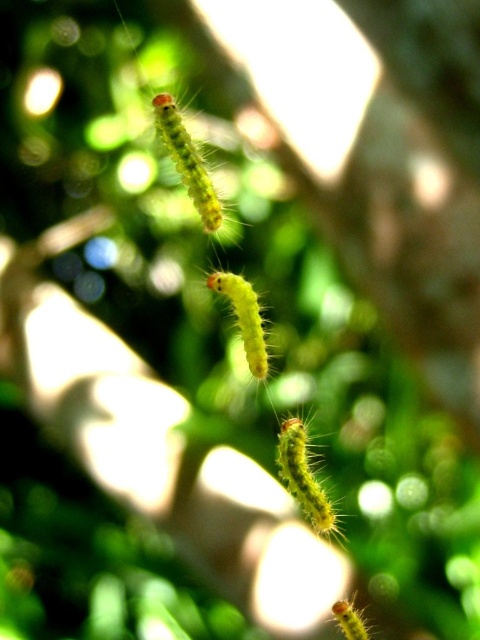
Question: Which point is farther to the camera?

Choices:
 (A) (233, 296)
 (B) (338, 600)
 (C) (312, 504)

Answer: (A)

Question: Considering the relative positions of fuzzy yellow caterpillar at center and yellow fuzzy caterpillar at center in the image provided, where is fuzzy yellow caterpillar at center located with respect to yellow fuzzy caterpillar at center?

Choices:
 (A) right
 (B) left

Answer: (A)

Question: Among these objects, which one is farthest from the camera?

Choices:
 (A) fuzzy yellow caterpillar at upper center
 (B) fuzzy yellow caterpillar at lower right

Answer: (A)

Question: Which point is closer to the camera taking this photo?

Choices:
 (A) (240, 332)
 (B) (317, 496)

Answer: (B)

Question: Considering the relative positions of fuzzy yellow caterpillar at center and fuzzy yellow caterpillar at lower right in the image provided, where is fuzzy yellow caterpillar at center located with respect to fuzzy yellow caterpillar at lower right?

Choices:
 (A) left
 (B) right

Answer: (A)

Question: Can you confirm if fuzzy yellow caterpillar at center is positioned above fuzzy yellow caterpillar at lower right?

Choices:
 (A) no
 (B) yes

Answer: (B)